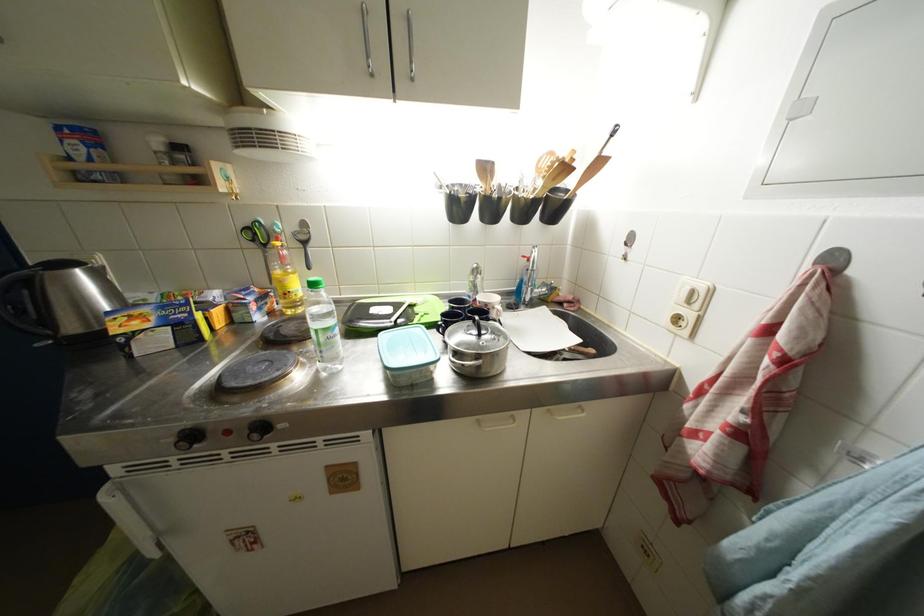
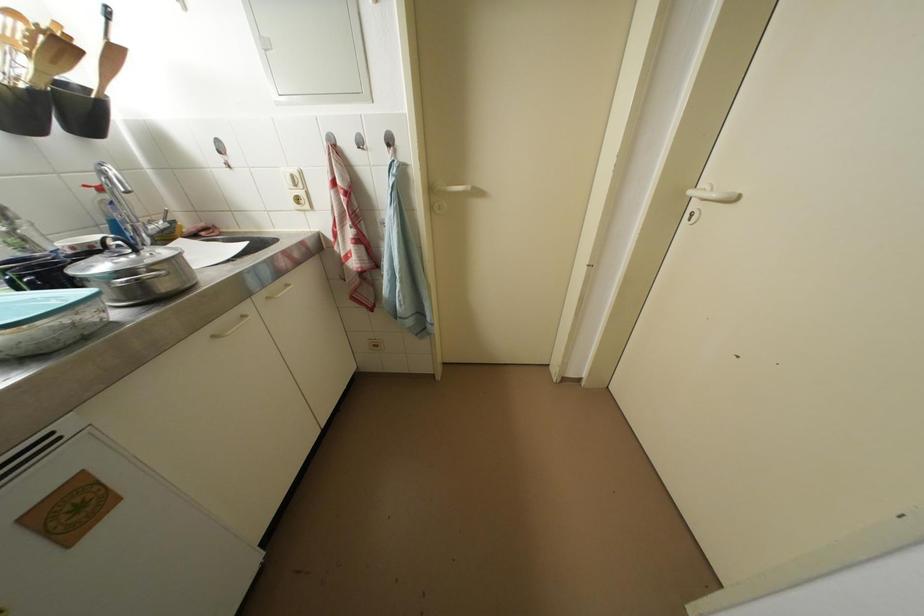
Find the pixel in the second image that matches (606,166) in the first image.

(120, 55)